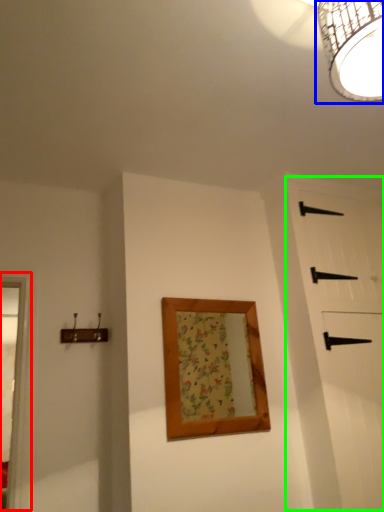
Question: Considering the real-world distances, which object is closest to window frame (highlighted by a red box)? lamp (highlighted by a blue box) or barn door (highlighted by a green box).

Choices:
 (A) lamp
 (B) barn door

Answer: (B)